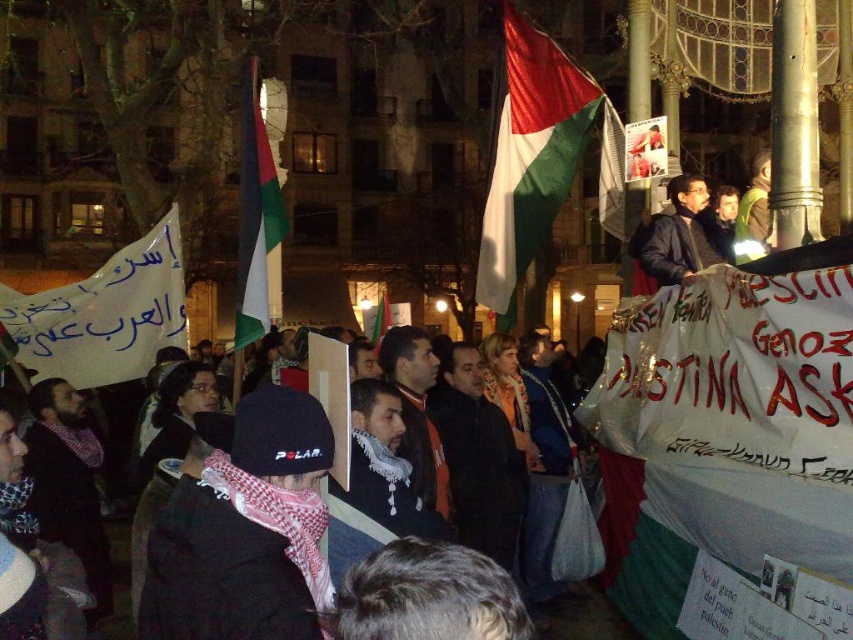
Does point (252, 321) come farther from viewer compared to point (383, 314)?

No, it is in front of (383, 314).

Between point (253, 236) and point (379, 307), which one is positioned behind?

The point (379, 307) is more distant.

In the scene shown: Who is more forward, (248, 170) or (373, 340)?

Point (248, 170)

At what (x,y) coordinates should I click in order to perform the action: click on green-white-red fabric flag at center. Please return your answer as a coordinate pair (x, y). The image size is (853, 640). Looking at the image, I should click on (254, 216).

Which of these two, green-white-red fabric flag at center or white scarf at center, stands shorter?

Standing shorter between the two is white scarf at center.

This screenshot has width=853, height=640. Identify the location of green-white-red fabric flag at center. (254, 216).

Identify the location of green-white-red fabric flag at center. (254, 216).

Is black fleece jacket at center above white fabric flag at center?

No, black fleece jacket at center is not above white fabric flag at center.

Between black fleece jacket at center and white fabric flag at center, which one is positioned lower?

black fleece jacket at center is below.

I want to click on black fleece jacket at center, so click(244, 528).

What are the coordinates of `black fleece jacket at center` in the screenshot? It's located at (244, 528).